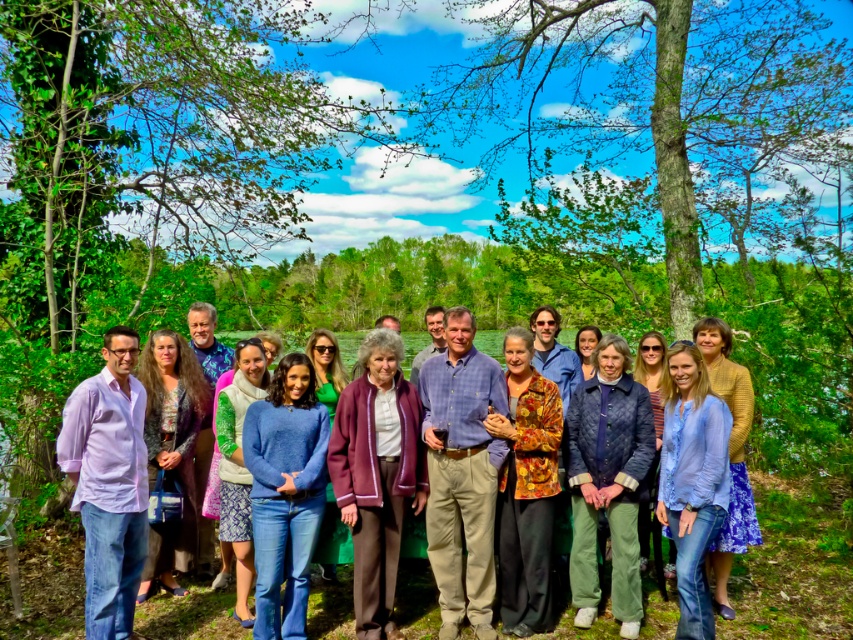
Consider the image. You are a photographer trying to capture a closeup of the blue cotton shirt at center and the light purple cotton shirt at left. Which shirt should you focus on to ensure both are in frame without zooming in further?

The blue cotton shirt at center is bigger than the light purple cotton shirt at left, so focusing on the blue cotton shirt at center will ensure both are in frame without needing to zoom further.